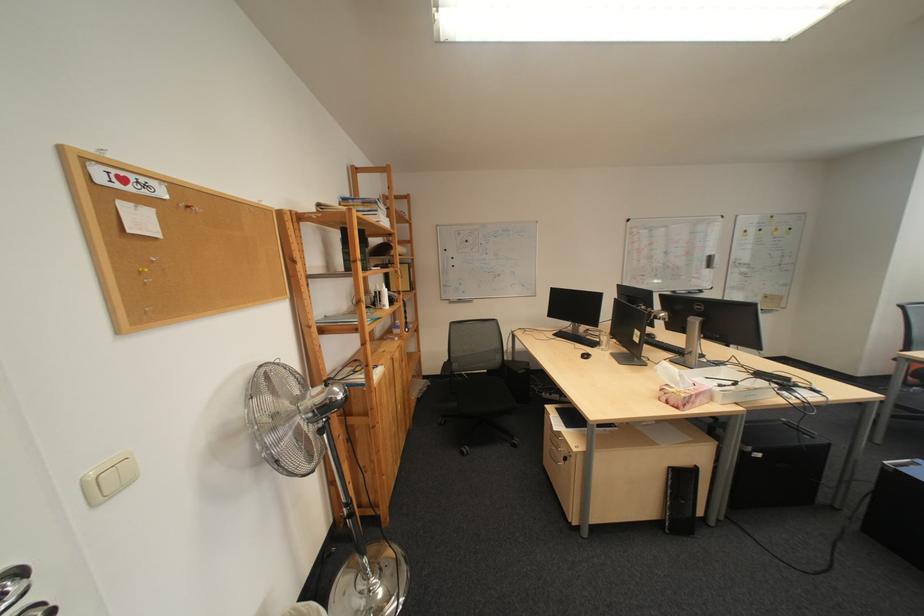
The image size is (924, 616). I want to click on yellow pushpin, so click(142, 270).